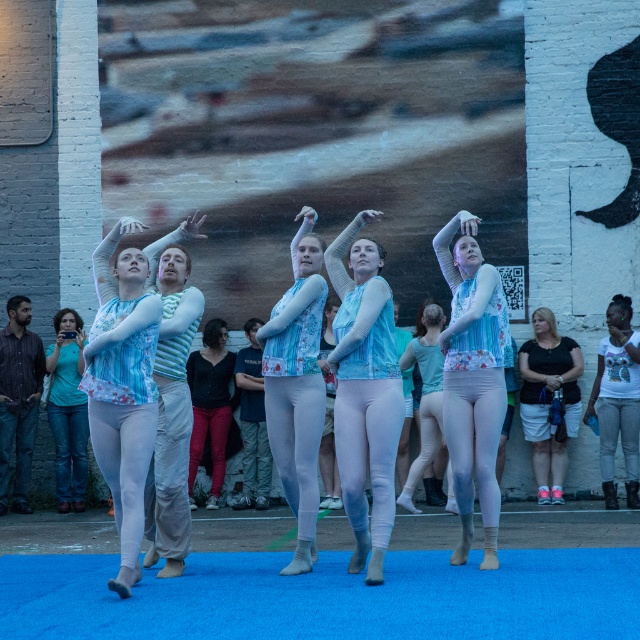
Question: In this image, where is matte blue leotard at center located relative to blue jeans at left?

Choices:
 (A) above
 (B) below

Answer: (A)

Question: Which object is the farthest from the denim pants at center?

Choices:
 (A) pink fabric shorts at right
 (B) dark blue shirt at left
 (C) light blue fabric at center
 (D) blue jeans at left

Answer: (A)

Question: Among these points, which one is nearest to the camera?

Choices:
 (A) (477, 371)
 (B) (428, 404)
 (C) (266, 477)

Answer: (A)

Question: Can you confirm if dark blue shirt at left is positioned to the right of denim pants at center?

Choices:
 (A) yes
 (B) no

Answer: (B)

Question: Estimate the real-world distances between objects in this image. Which object is farther from the black jersey at center?

Choices:
 (A) dark blue shirt at left
 (B) matte blue leotard at center

Answer: (B)

Question: Does dark blue shirt at left appear on the right side of black jersey at center?

Choices:
 (A) yes
 (B) no

Answer: (B)